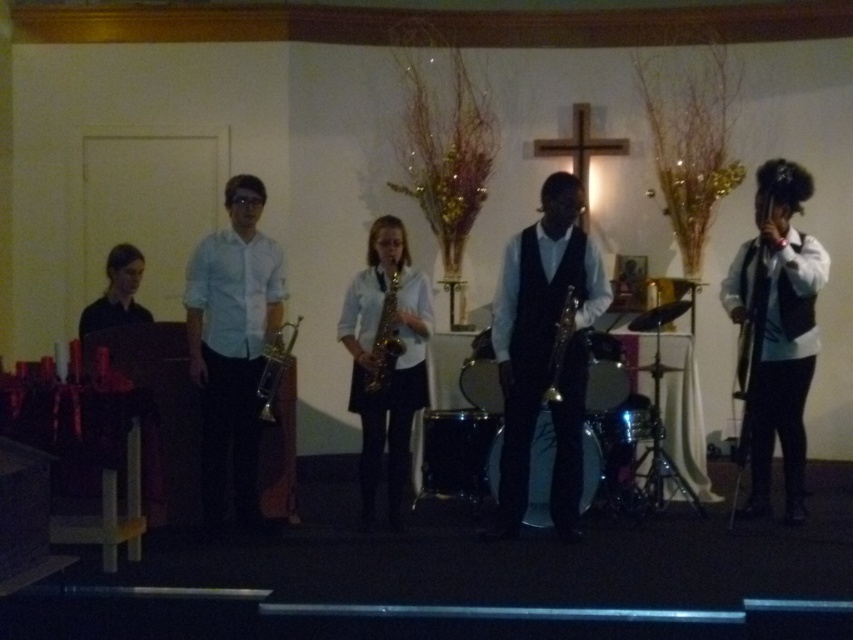
Can you confirm if white glossy shirt at center is thinner than shiny silver saxophone at center?

Incorrect, white glossy shirt at center's width is not less than shiny silver saxophone at center's.

Can you confirm if white glossy shirt at center is positioned above shiny silver saxophone at center?

No.

You are a GUI agent. You are given a task and a screenshot of the screen. Output one action in this format:
    pyautogui.click(x=<x>, y=<y>)
    Task: Click on the white glossy shirt at center
    
    Given the screenshot: What is the action you would take?
    pyautogui.click(x=231, y=346)

Image resolution: width=853 pixels, height=640 pixels. What are the coordinates of `white glossy shirt at center` in the screenshot? It's located at (231, 346).

Describe the element at coordinates (231, 346) in the screenshot. I see `white glossy shirt at center` at that location.

Can you confirm if white glossy shirt at center is taller than gold shiny saxophone at center?

Yes.

Locate an element on the screen. Image resolution: width=853 pixels, height=640 pixels. white glossy shirt at center is located at coordinates (231, 346).

The height and width of the screenshot is (640, 853). I want to click on white glossy shirt at center, so click(x=231, y=346).

Between black satin vest at center and gold metallic saxophone at center, which one is positioned lower?

black satin vest at center is below.

Can you confirm if black satin vest at center is positioned above gold metallic saxophone at center?

Incorrect, black satin vest at center is not positioned above gold metallic saxophone at center.

Locate an element on the screen. This screenshot has height=640, width=853. black satin vest at center is located at coordinates (544, 352).